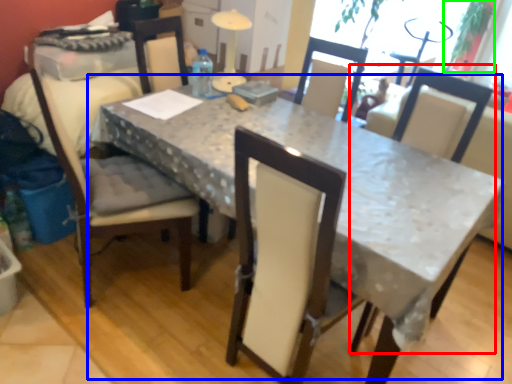
Question: Estimate the real-world distances between objects in this image. Which object is farther from chair (highlighted by a red box), table (highlighted by a blue box) or plant (highlighted by a green box)?

Choices:
 (A) table
 (B) plant

Answer: (B)